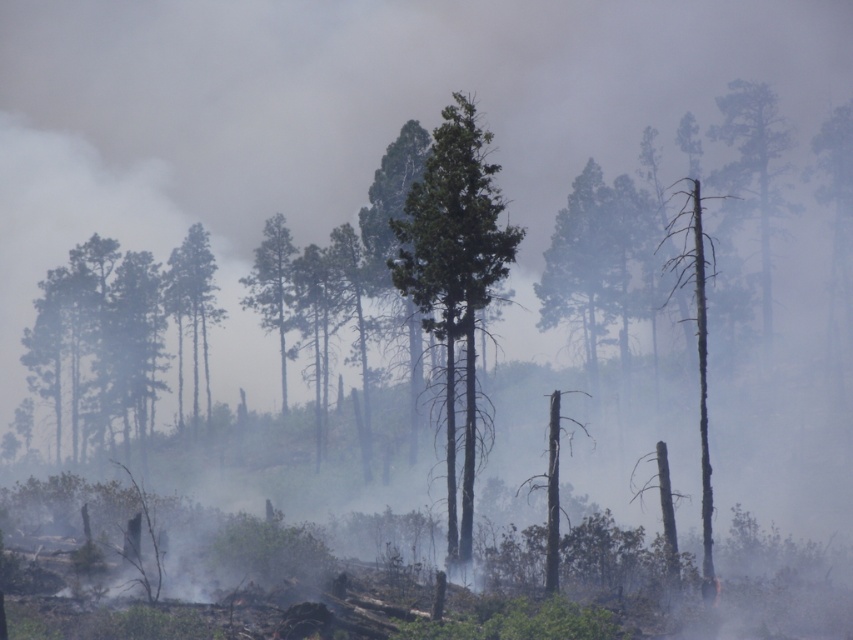
Does green rough bark tree at center appear under green textured tree at center?

No.

Does point (474, 257) come behind point (271, 291)?

That is False.

In order to click on green rough bark tree at center in this screenshot , I will do `click(454, 269)`.

Who is higher up, green rough bark tree at center or green bark tree at right?

green bark tree at right is higher up.

Does green rough bark tree at center appear over green bark tree at right?

No, green rough bark tree at center is not above green bark tree at right.

Does point (476, 246) come in front of point (730, 116)?

That is True.

In order to click on green rough bark tree at center in this screenshot , I will do `click(454, 269)`.

Is green bark tree at right smaller than charred wood tree trunk at right?

No.

Does point (776, 147) come farther from viewer compared to point (672, 289)?

Yes, it is behind point (672, 289).

Is point (769, 120) less distant than point (700, 282)?

No, it is behind (700, 282).

Identify the location of green bark tree at right. This screenshot has width=853, height=640. (755, 157).